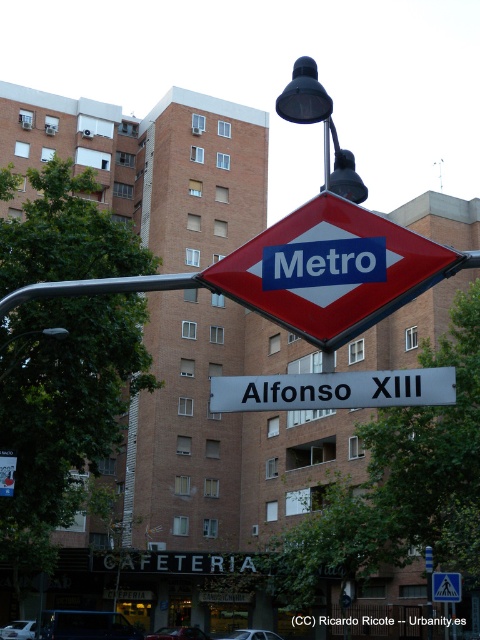
The height and width of the screenshot is (640, 480). Describe the element at coordinates (333, 388) in the screenshot. I see `white metallic signboard at center` at that location.

Who is more distant from viewer, (392, 403) or (1, 346)?

Positioned behind is point (1, 346).

Does point (291, 381) come in front of point (51, 332)?

Yes, it is in front of point (51, 332).

Where is `white metallic signboard at center`? The image size is (480, 640). white metallic signboard at center is located at coordinates (333, 388).

Does point (276, 316) come farther from viewer compared to point (440, 572)?

No, (276, 316) is in front of (440, 572).

Does point (282, 269) come behind point (455, 586)?

No, it is not.

Locate an element on the screen. red diamond sign at center is located at coordinates (332, 269).

Is yellow reflective triangle at upper center thinner than metallic pole at lower left?

Yes.

Does yellow reflective triangle at upper center appear on the left side of metallic pole at lower left?

In fact, yellow reflective triangle at upper center is to the right of metallic pole at lower left.

The image size is (480, 640). I want to click on yellow reflective triangle at upper center, so coord(445,586).